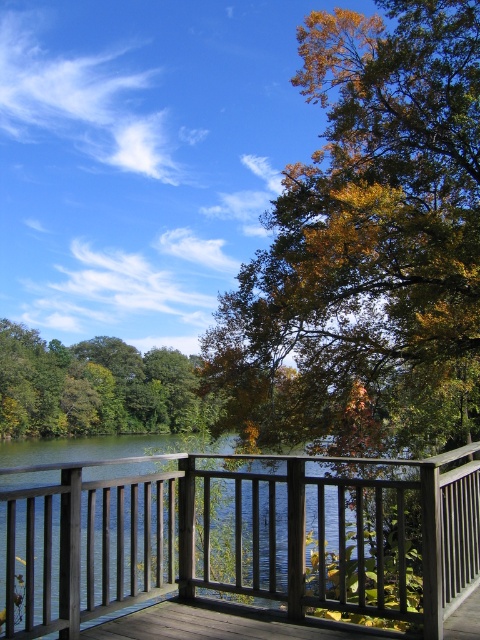
Question: Is wooden porch at center above green leafy tree at lower left?

Choices:
 (A) yes
 (B) no

Answer: (A)

Question: Which object is closer to the camera taking this photo?

Choices:
 (A) green leafy tree at lower left
 (B) golden yellow leaves at center
 (C) wooden porch at center

Answer: (C)

Question: Can you confirm if golden yellow leaves at center is smaller than wooden porch at center?

Choices:
 (A) yes
 (B) no

Answer: (B)

Question: Estimate the real-world distances between objects in this image. Which object is farther from the wooden porch at center?

Choices:
 (A) green leafy tree at lower left
 (B) golden yellow leaves at center

Answer: (A)

Question: Which point is closer to the camera taking this photo?

Choices:
 (A) (444, 93)
 (B) (460, 589)

Answer: (B)

Question: Is golden yellow leaves at center wider than wooden porch at center?

Choices:
 (A) yes
 (B) no

Answer: (A)